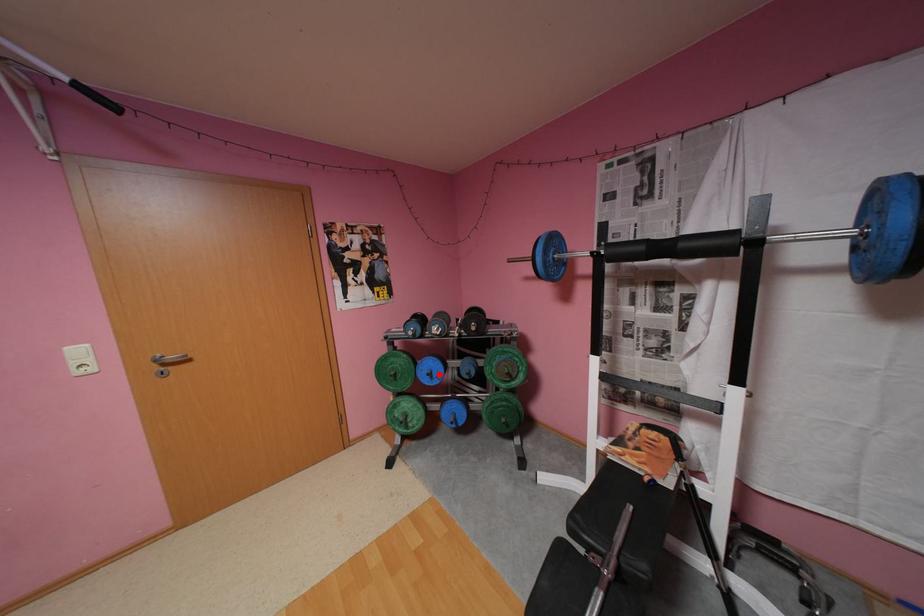
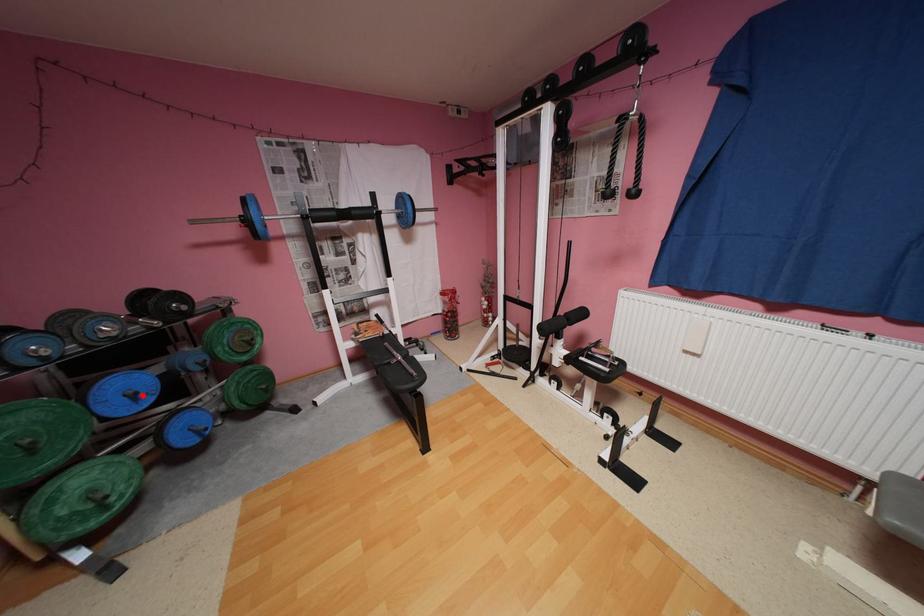
I am providing you with two images of the same scene from different viewpoints. A red point is marked on the first image and another point is marked on the second image. Do the highlighted points in image1 and image2 indicate the same real-world spot?

Yes